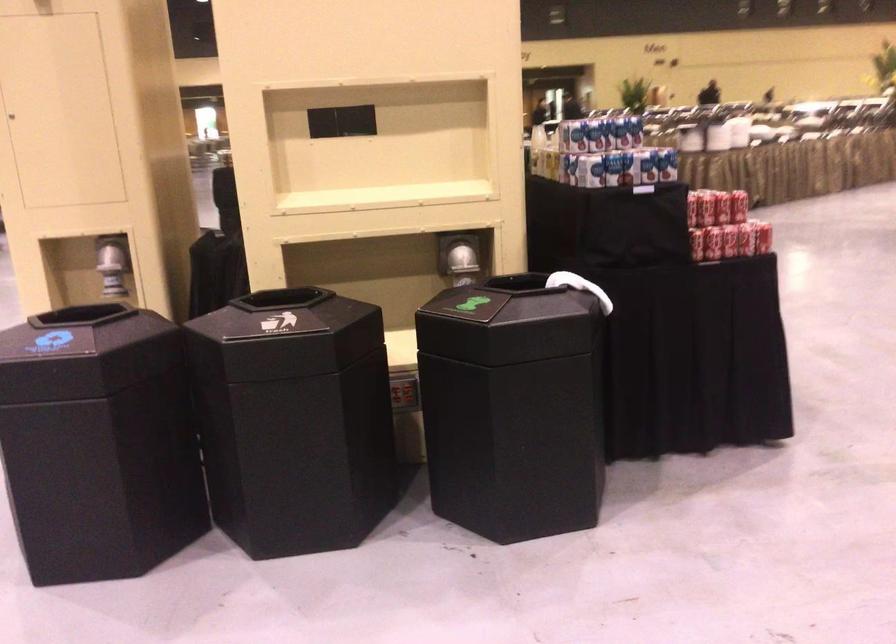
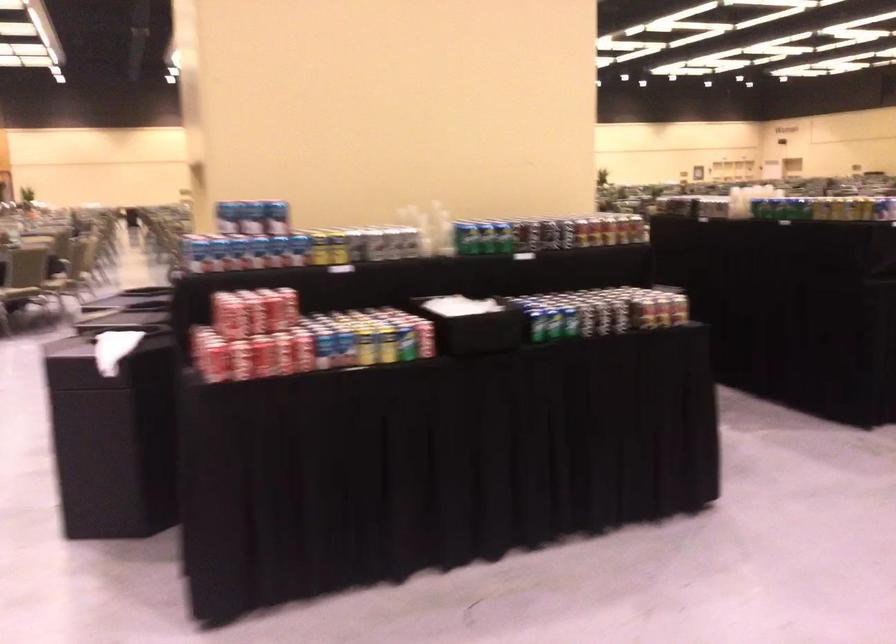
Locate, in the second image, the point that corresponds to [618,136] in the first image.

(229, 216)